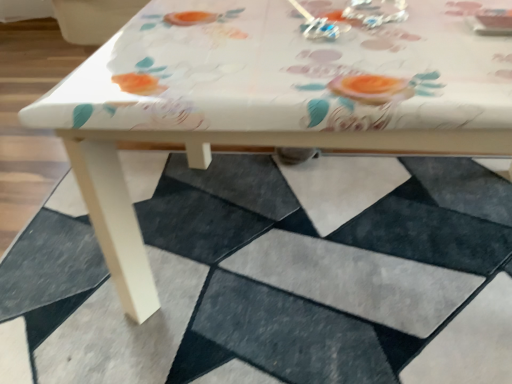
Identify the location of free space to the left of metallic silver earrings at upper center. This screenshot has height=384, width=512. (215, 18).